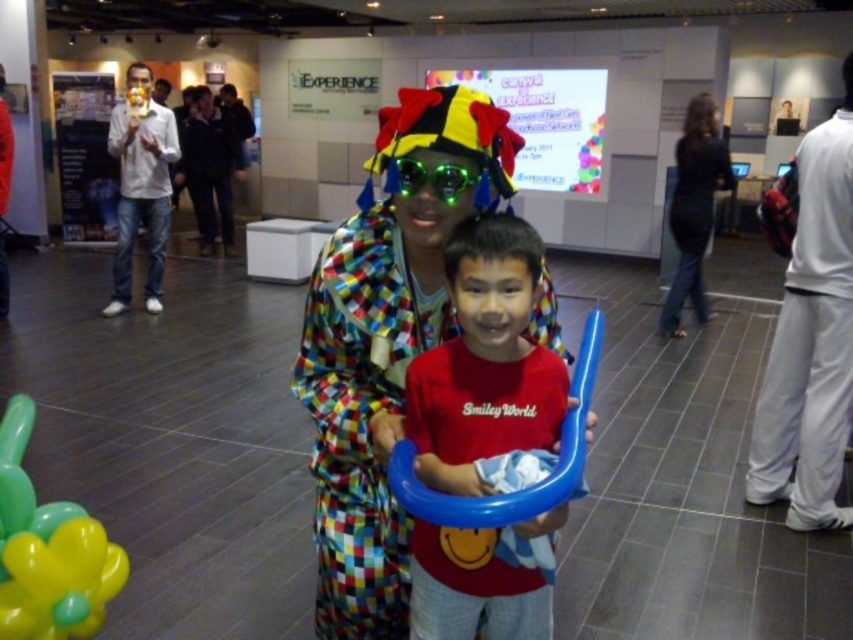
Does white fabric pants at right have a smaller size compared to rubber balloon at lower left?

Incorrect, white fabric pants at right is not smaller in size than rubber balloon at lower left.

Can you confirm if white fabric pants at right is shorter than rubber balloon at lower left?

No.

Is point (793, 284) closer to viewer compared to point (16, 403)?

No.

Find the location of a particular element. This screenshot has height=640, width=853. white fabric pants at right is located at coordinates (811, 340).

Can you confirm if rubber balloon at lower left is positioned to the left of multicolored fabric clown at center?

No, rubber balloon at lower left is not to the left of multicolored fabric clown at center.

In the scene shown: Is rubber balloon at lower left behind multicolored fabric clown at center?

No.

Who is more distant from viewer, (20, 584) or (0, 163)?

The point (0, 163) is more distant.

What are the coordinates of `rubber balloon at lower left` in the screenshot? It's located at (48, 550).

Is matte white shirt at left wider than multicolored fabric clown at center?

Yes, matte white shirt at left is wider than multicolored fabric clown at center.

Locate an element on the screen. matte white shirt at left is located at coordinates (141, 186).